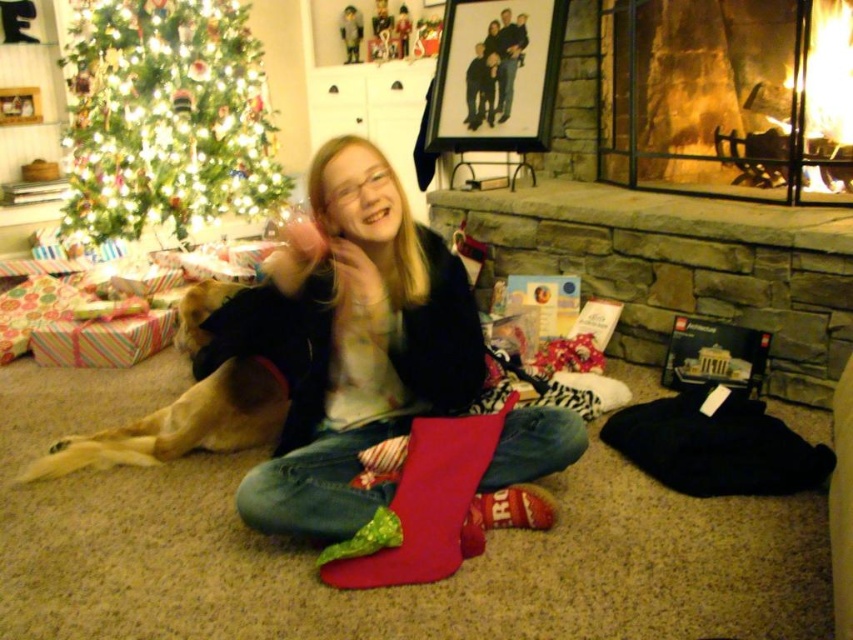
Question: Can you confirm if matte red stocking at center is wider than red velvet stocking at lower center?

Choices:
 (A) yes
 (B) no

Answer: (A)

Question: Among these objects, which one is nearest to the camera?

Choices:
 (A) matte red stocking at center
 (B) brick fireplace at right
 (C) red velvet stocking at lower center

Answer: (A)

Question: Is green artificial christmas tree at upper left thinner than red velvet stocking at lower center?

Choices:
 (A) no
 (B) yes

Answer: (A)

Question: Does brick fireplace at right have a smaller size compared to green artificial christmas tree at upper left?

Choices:
 (A) yes
 (B) no

Answer: (A)

Question: Among these points, which one is nearest to the camera?

Choices:
 (A) (347, 504)
 (B) (791, 204)
 (C) (190, 38)

Answer: (A)

Question: Based on their relative distances, which object is farther from the green artificial christmas tree at upper left?

Choices:
 (A) matte red stocking at center
 (B) brick fireplace at right

Answer: (B)